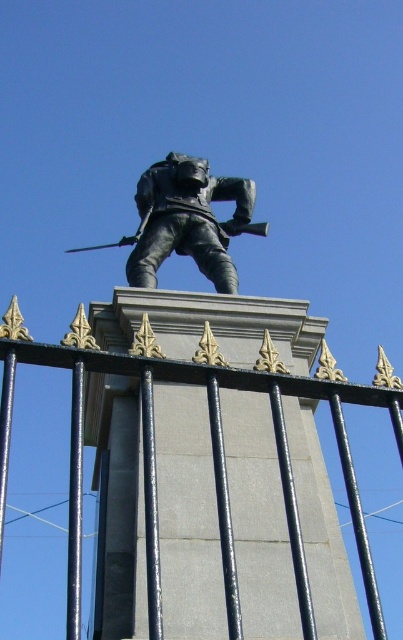
Does black metal fence at center come behind bronze statue at center?

That is False.

Describe the element at coordinates (211, 464) in the screenshot. I see `black metal fence at center` at that location.

Find the location of a particular element. The image size is (403, 640). black metal fence at center is located at coordinates 211,464.